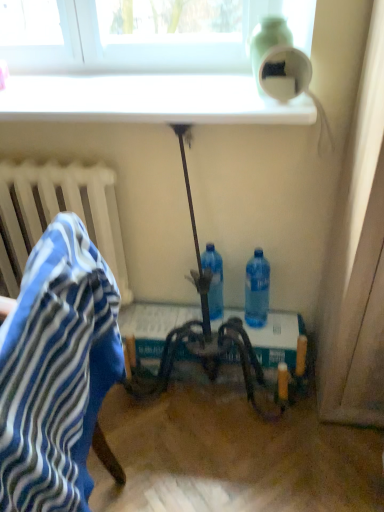
Find the location of a particular element. Image resolution: width=384 pixels, height=512 pixels. free region on the left part of green matte bottle at upper right, placed as the third bottle when sorted from bottom to top is located at coordinates (209, 90).